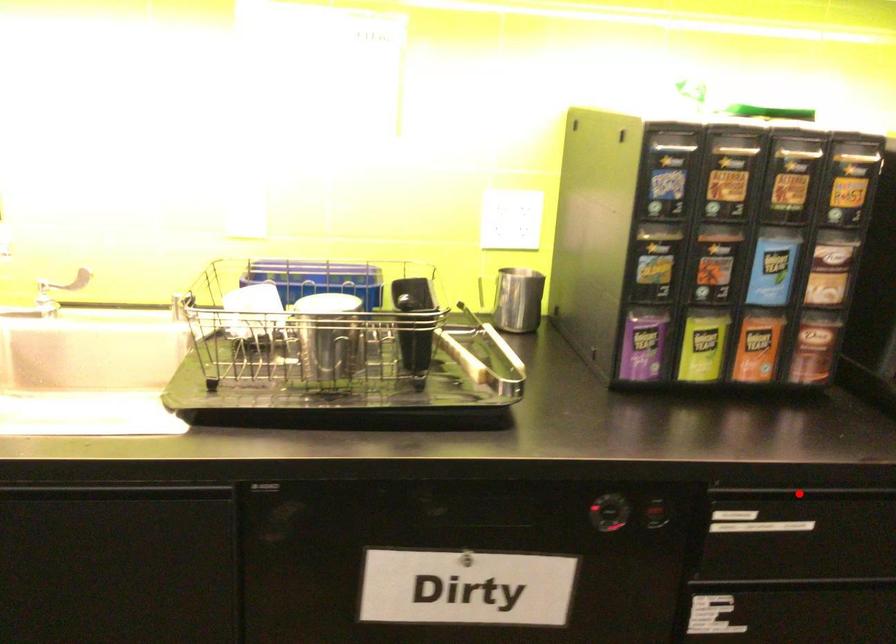
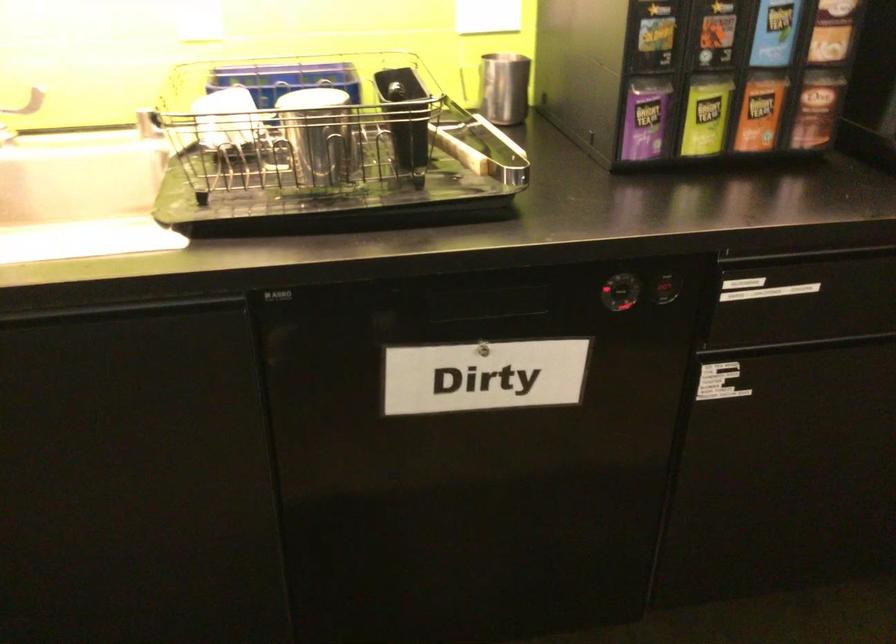
Where in the second image is the point corresponding to the highlighted location from the first image?

(807, 254)